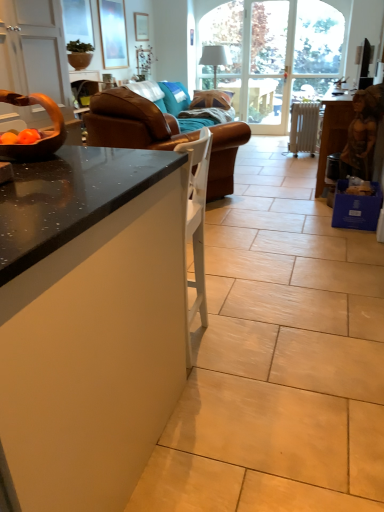
Question: Considering the relative positions of white metallic radiator at right and brown leather couch at center in the image provided, is white metallic radiator at right to the left of brown leather couch at center from the viewer's perspective?

Choices:
 (A) no
 (B) yes

Answer: (A)

Question: Can you confirm if white metallic radiator at right is positioned to the right of brown leather couch at center?

Choices:
 (A) yes
 (B) no

Answer: (A)

Question: Considering the relative sizes of white metallic radiator at right and brown leather couch at center in the image provided, is white metallic radiator at right wider than brown leather couch at center?

Choices:
 (A) no
 (B) yes

Answer: (A)

Question: From a real-world perspective, does white metallic radiator at right stand above brown leather couch at center?

Choices:
 (A) no
 (B) yes

Answer: (A)

Question: Is white metallic radiator at right next to brown leather couch at center and touching it?

Choices:
 (A) no
 (B) yes

Answer: (A)

Question: Considering the positions of black glossy desk at lower left and wooden picture frame at upper center, which is the 1th picture frame from right to left, in the image, is black glossy desk at lower left taller or shorter than wooden picture frame at upper center, which is the 1th picture frame from right to left,?

Choices:
 (A) tall
 (B) short

Answer: (A)

Question: Is point (82, 435) closer or farther from the camera than point (142, 37)?

Choices:
 (A) closer
 (B) farther

Answer: (A)

Question: From a real-world perspective, is black glossy desk at lower left above or below wooden picture frame at upper center, acting as the first picture frame starting from the back?

Choices:
 (A) below
 (B) above

Answer: (A)

Question: Is black glossy desk at lower left to the left or to the right of wooden picture frame at upper center, which is the 1th picture frame from right to left, in the image?

Choices:
 (A) left
 (B) right

Answer: (B)

Question: Based on their positions, is white glass screen door at center located to the left or right of blue fabric pillow at center?

Choices:
 (A) left
 (B) right

Answer: (B)

Question: From the image's perspective, relative to blue fabric pillow at center, is white glass screen door at center above or below?

Choices:
 (A) above
 (B) below

Answer: (A)

Question: From a real-world perspective, is white glass screen door at center above or below blue fabric pillow at center?

Choices:
 (A) above
 (B) below

Answer: (A)

Question: Considering the positions of white glass screen door at center and blue fabric pillow at center in the image, is white glass screen door at center taller or shorter than blue fabric pillow at center?

Choices:
 (A) tall
 (B) short

Answer: (A)

Question: Based on their positions, is blue cardboard box at lower right located to the left or right of white glass screen door at center?

Choices:
 (A) right
 (B) left

Answer: (A)

Question: Looking at the image, does blue cardboard box at lower right seem bigger or smaller compared to white glass screen door at center?

Choices:
 (A) big
 (B) small

Answer: (B)